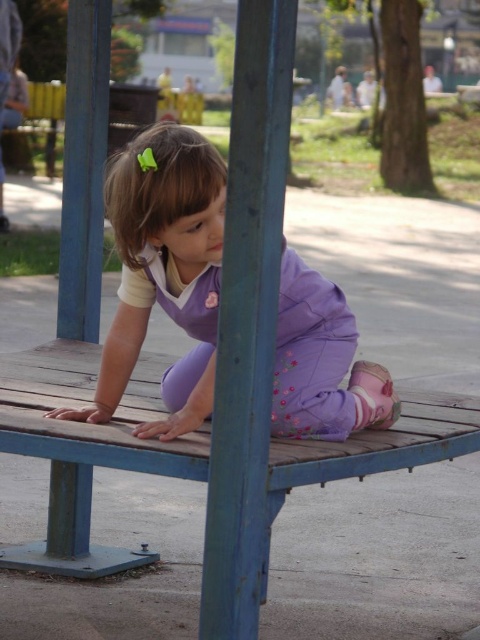
You are a parent trying to place a small toy between the wooden bench at center and the purple fabric at center. The toy is 12 inches long. Will it fit in the space between them?

The wooden bench at center and purple fabric at center are 15.24 inches apart. Since the toy is 12 inches long, it will fit in the space between them because 12 inches is shorter than 15.24 inches.

You are a parent trying to find a shaded area for your child to sit in the park. You see the wooden bench at center and the purple fabric at center. Which object provides shade, and where is it located relative to the bench?

The purple fabric at center is positioned above the wooden bench at center, so it provides shade over the bench.